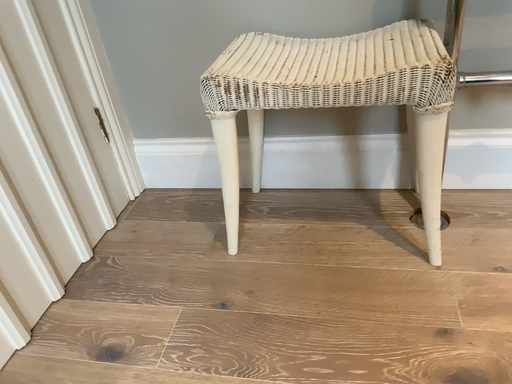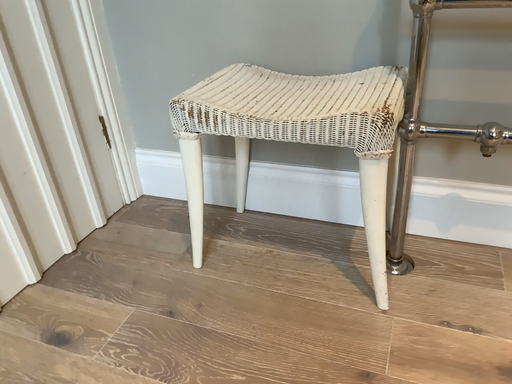
Question: How did the camera likely rotate when shooting the video?

Choices:
 (A) rotated left
 (B) rotated right

Answer: (A)